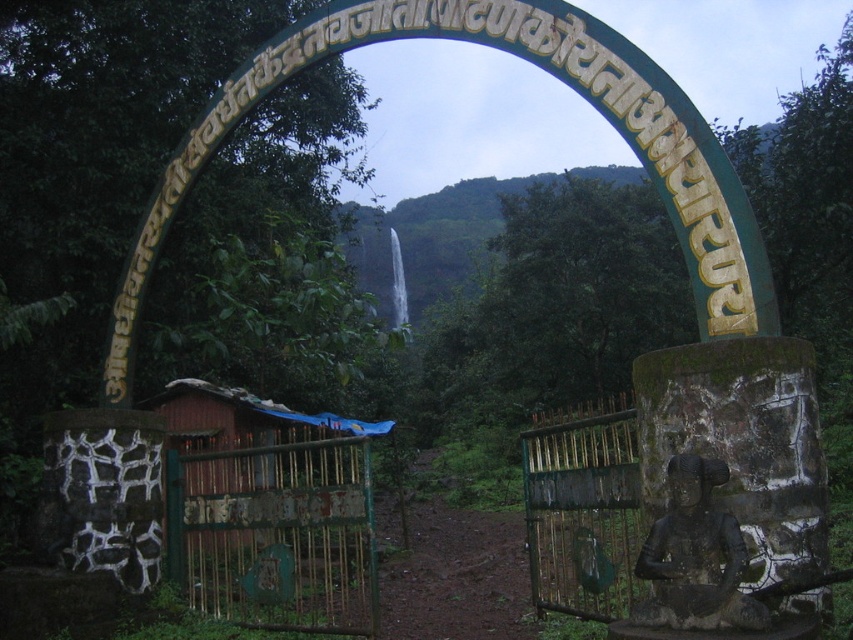
Question: Is black stone statue at lower right further to the viewer compared to wooden hut at center?

Choices:
 (A) no
 (B) yes

Answer: (A)

Question: Is wooden hut at center thinner than green stone archway at center?

Choices:
 (A) yes
 (B) no

Answer: (A)

Question: Which point is closer to the camera?

Choices:
 (A) green stone archway at center
 (B) black stone statue at lower right
 (C) wooden hut at center

Answer: (B)

Question: Which point appears closest to the camera in this image?

Choices:
 (A) (398, 305)
 (B) (672, 572)
 (C) (376, 422)

Answer: (B)

Question: Among these points, which one is nearest to the camera?

Choices:
 (A) (393, 275)
 (B) (190, 404)

Answer: (B)

Question: Is black stone statue at lower right above wooden hut at center?

Choices:
 (A) no
 (B) yes

Answer: (B)